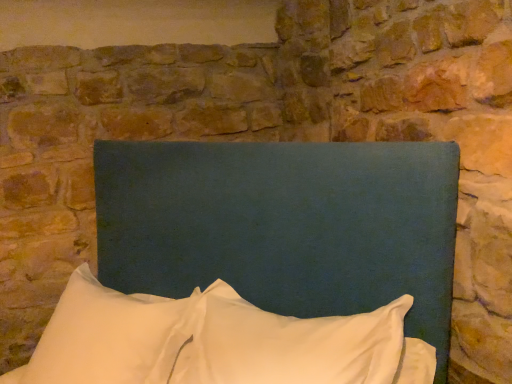
Question: Can you confirm if white soft pillow at lower left, which is counted as the 2th pillow, starting from the right, is taller than white soft pillow at center, which is the first pillow from right to left?

Choices:
 (A) no
 (B) yes

Answer: (B)

Question: Is white soft pillow at lower left, arranged as the first pillow when viewed from the left, not close to white soft pillow at center, which is the first pillow from right to left?

Choices:
 (A) no
 (B) yes

Answer: (A)

Question: Would you say white soft pillow at center, which is the first pillow from right to left, is part of white soft pillow at lower left, which is counted as the 2th pillow, starting from the right,'s contents?

Choices:
 (A) no
 (B) yes

Answer: (A)

Question: Is white soft pillow at lower left, arranged as the first pillow when viewed from the left, next to white soft pillow at center, which is the first pillow from right to left?

Choices:
 (A) no
 (B) yes

Answer: (B)

Question: From a real-world perspective, is white soft pillow at lower left, arranged as the first pillow when viewed from the left, physically above white soft pillow at center, the 2th pillow when ordered from left to right?

Choices:
 (A) yes
 (B) no

Answer: (B)

Question: Can you confirm if white soft pillow at lower left, which is counted as the 2th pillow, starting from the right, is bigger than white soft pillow at center, which is the first pillow from right to left?

Choices:
 (A) no
 (B) yes

Answer: (B)

Question: Can you confirm if white soft pillow at center, the 2th pillow when ordered from left to right, is positioned to the left of white soft pillow at lower left, arranged as the first pillow when viewed from the left?

Choices:
 (A) yes
 (B) no

Answer: (B)

Question: Considering the relative positions of white soft pillow at center, the 2th pillow when ordered from left to right, and white soft pillow at lower left, which is counted as the 2th pillow, starting from the right, in the image provided, is white soft pillow at center, the 2th pillow when ordered from left to right, behind white soft pillow at lower left, which is counted as the 2th pillow, starting from the right,?

Choices:
 (A) no
 (B) yes

Answer: (A)

Question: Can you confirm if white soft pillow at center, which is the first pillow from right to left, is taller than white soft pillow at lower left, which is counted as the 2th pillow, starting from the right?

Choices:
 (A) yes
 (B) no

Answer: (B)

Question: Considering the relative positions of white soft pillow at center, which is the first pillow from right to left, and white soft pillow at lower left, arranged as the first pillow when viewed from the left, in the image provided, is white soft pillow at center, which is the first pillow from right to left, to the right of white soft pillow at lower left, arranged as the first pillow when viewed from the left, from the viewer's perspective?

Choices:
 (A) yes
 (B) no

Answer: (A)

Question: From a real-world perspective, is white soft pillow at center, the 2th pillow when ordered from left to right, physically above white soft pillow at lower left, arranged as the first pillow when viewed from the left?

Choices:
 (A) yes
 (B) no

Answer: (A)

Question: Is white soft pillow at lower left, arranged as the first pillow when viewed from the left, surrounded by white soft pillow at center, the 2th pillow when ordered from left to right?

Choices:
 (A) no
 (B) yes

Answer: (A)

Question: From the image's perspective, is white soft pillow at center, which is the first pillow from right to left, located beneath teal fabric headboard at center?

Choices:
 (A) yes
 (B) no

Answer: (A)